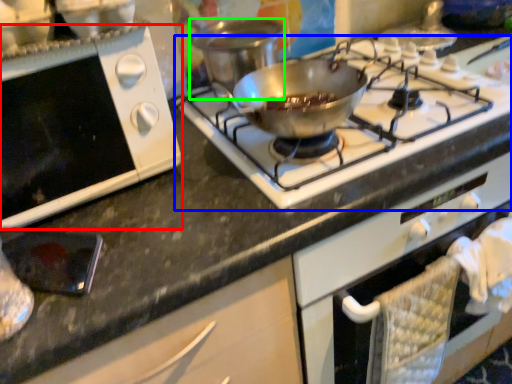
Question: Which object is the farthest from oven (highlighted by a red box)? Choose among these: gas stove (highlighted by a blue box) or pot/pan (highlighted by a green box).

Choices:
 (A) gas stove
 (B) pot/pan

Answer: (A)